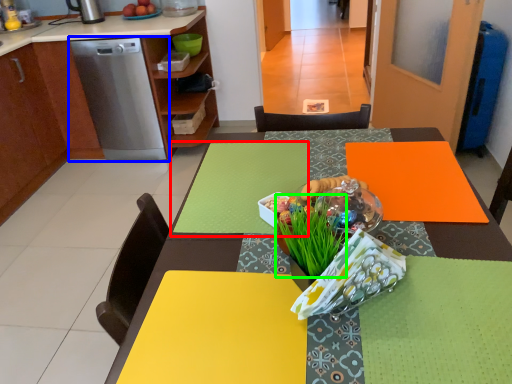
Question: Estimate the real-world distances between objects in this image. Which object is closer to tablecloth (highlighted by a red box), home appliance (highlighted by a blue box) or grass (highlighted by a green box)?

Choices:
 (A) home appliance
 (B) grass

Answer: (B)